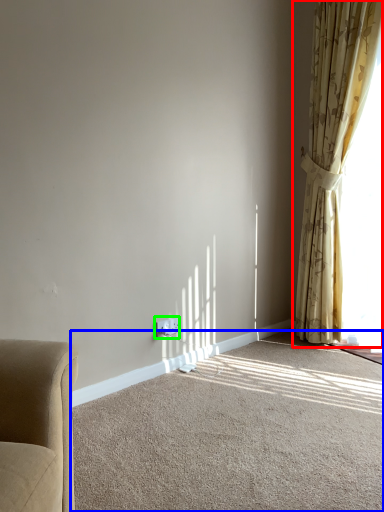
Question: Estimate the real-world distances between objects in this image. Which object is closer to curtain (highlighted by a red box), plain (highlighted by a blue box) or electric outlet (highlighted by a green box)?

Choices:
 (A) plain
 (B) electric outlet

Answer: (A)